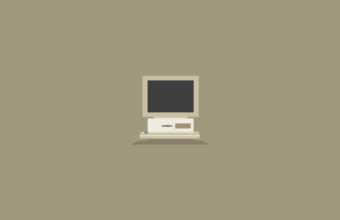
Identify the location of computer screen. (168, 96).